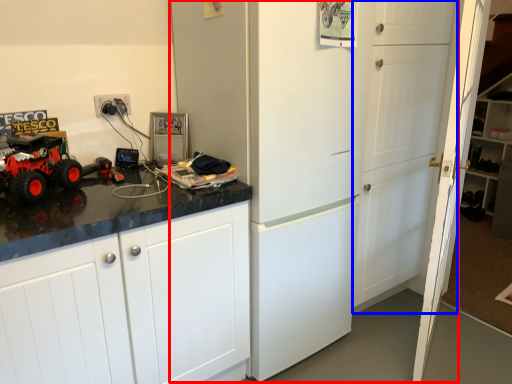
Question: Which of the following is the farthest to the observer, refrigerator (highlighted by a red box) or door (highlighted by a blue box)?

Choices:
 (A) refrigerator
 (B) door

Answer: (B)